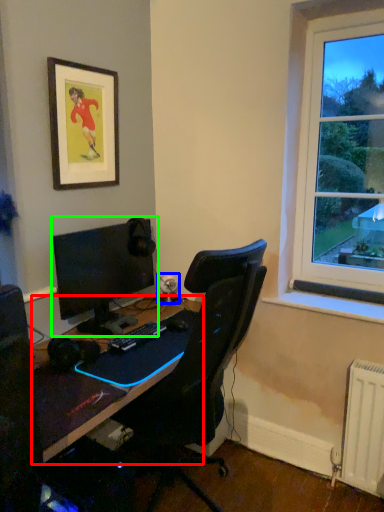
Question: Which is nearer to the desk (highlighted by a red box)? speaker (highlighted by a blue box) or computer monitor (highlighted by a green box).

Choices:
 (A) speaker
 (B) computer monitor

Answer: (B)